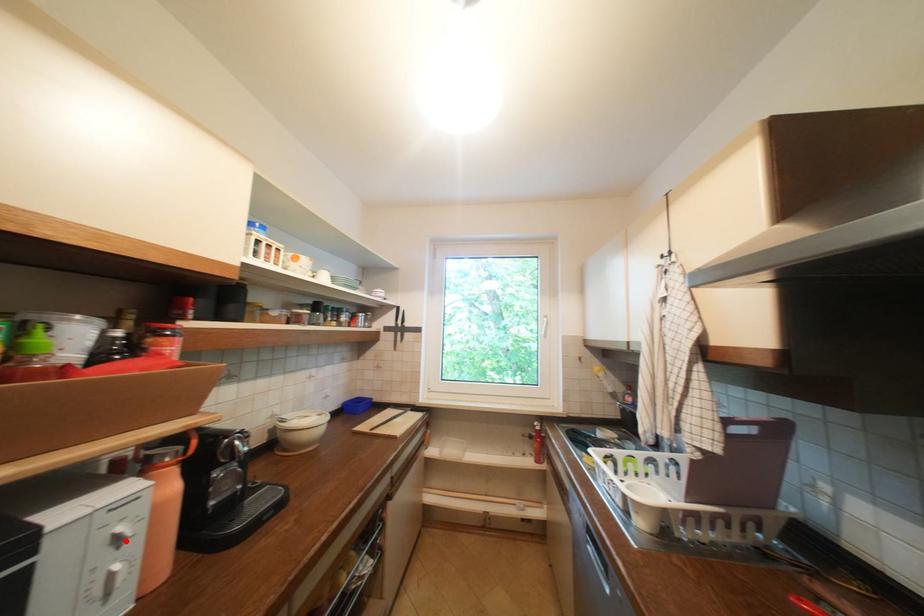
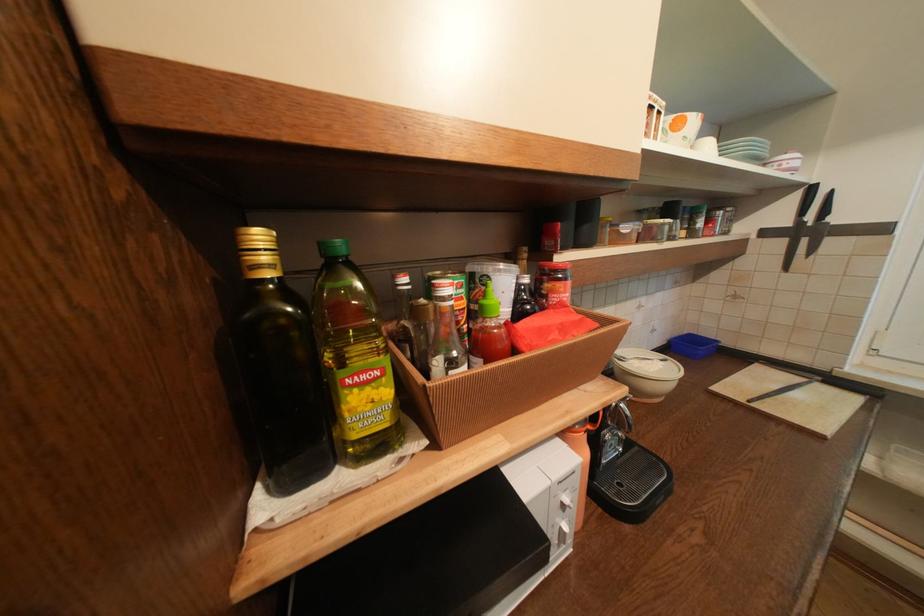
In the second image, find the point that corresponds to the highlighted location in the first image.

(573, 507)